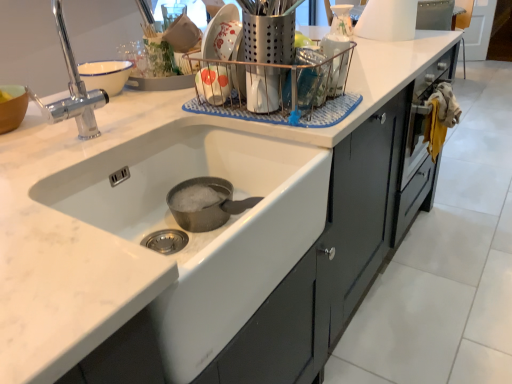
The width and height of the screenshot is (512, 384). What do you see at coordinates (336, 62) in the screenshot? I see `clear plastic container at upper center, the second appliance in the left-to-right sequence` at bounding box center [336, 62].

At what (x,y) coordinates should I click in order to perform the action: click on satin silver utensil holder at upper center, which appears as the 4th appliance when viewed from the right. Please return your answer as a coordinate pair (x, y). This screenshot has height=384, width=512. Looking at the image, I should click on (268, 31).

How much space does white glossy coffee pot at upper center, the first appliance when ordered from back to front, occupy horizontally?

white glossy coffee pot at upper center, the first appliance when ordered from back to front, is 10.92 centimeters in width.

In order to click on white glossy sink at center in this screenshot , I will do `click(205, 232)`.

Based on their positions, is clear plastic container at upper center, the third appliance viewed from the right, located to the left or right of white glossy sink at center?

From the image, it's evident that clear plastic container at upper center, the third appliance viewed from the right, is to the right of white glossy sink at center.

Is clear plastic container at upper center, marked as the 2th appliance in a front-to-back arrangement, wider than white glossy sink at center?

In fact, clear plastic container at upper center, marked as the 2th appliance in a front-to-back arrangement, might be narrower than white glossy sink at center.

Is clear plastic container at upper center, the third appliance viewed from the right, facing away from white glossy sink at center?

No, white glossy sink at center is not at the back of clear plastic container at upper center, the third appliance viewed from the right.

Is clear plastic container at upper center, marked as the 2th appliance in a front-to-back arrangement, bigger or smaller than white glossy sink at center?

Clearly, clear plastic container at upper center, marked as the 2th appliance in a front-to-back arrangement, is smaller in size than white glossy sink at center.

How different are the orientations of white glossy paper towel dispenser at upper right, arranged as the second appliance when viewed from the back, and satin silver utensil holder at upper center, the first appliance positioned from the front, in degrees?

93.9 degrees.

Image resolution: width=512 pixels, height=384 pixels. Identify the location of appliance above the white glossy paper towel dispenser at upper right, arranged as the second appliance when viewed from the back (from a real-world perspective). (268, 31).

Which object is closer to the camera, white glossy paper towel dispenser at upper right, which is the fourth appliance from left to right, or satin silver utensil holder at upper center, which appears as the 4th appliance when viewed from the right?

satin silver utensil holder at upper center, which appears as the 4th appliance when viewed from the right, is in front.

Considering the relative sizes of white glossy paper towel dispenser at upper right, placed as the 1th appliance when sorted from right to left, and satin silver utensil holder at upper center, the first appliance positioned from the front, in the image provided, is white glossy paper towel dispenser at upper right, placed as the 1th appliance when sorted from right to left, wider than satin silver utensil holder at upper center, the first appliance positioned from the front,?

Indeed, white glossy paper towel dispenser at upper right, placed as the 1th appliance when sorted from right to left, has a greater width compared to satin silver utensil holder at upper center, the first appliance positioned from the front.

From the image's perspective, does clear plastic container at upper center, the second appliance in the left-to-right sequence, appear higher than white glossy paper towel dispenser at upper right, which is the fourth appliance from left to right?

No.

Is clear plastic container at upper center, the third appliance in the back-to-front sequence, in front of or behind white glossy paper towel dispenser at upper right, arranged as the second appliance when viewed from the back, in the image?

clear plastic container at upper center, the third appliance in the back-to-front sequence, is positioned closer to the viewer than white glossy paper towel dispenser at upper right, arranged as the second appliance when viewed from the back.

Could you tell me if clear plastic container at upper center, the second appliance in the left-to-right sequence, is turned towards white glossy paper towel dispenser at upper right, arranged as the second appliance when viewed from the back?

No, clear plastic container at upper center, the second appliance in the left-to-right sequence, is not turned towards white glossy paper towel dispenser at upper right, arranged as the second appliance when viewed from the back.

Does white glossy sink at center have a greater height compared to satin silver utensil holder at upper center, which appears as the fourth appliance when viewed from the back?

Correct, white glossy sink at center is much taller as satin silver utensil holder at upper center, which appears as the fourth appliance when viewed from the back.

From a real-world perspective, does white glossy sink at center stand above satin silver utensil holder at upper center, the first appliance positioned from the front?

Incorrect, from a real-world perspective, white glossy sink at center is lower than satin silver utensil holder at upper center, the first appliance positioned from the front.

Can we say white glossy sink at center lies outside satin silver utensil holder at upper center, which appears as the 4th appliance when viewed from the right?

Indeed, white glossy sink at center is completely outside satin silver utensil holder at upper center, which appears as the 4th appliance when viewed from the right.

From the image's perspective, is white glossy coffee pot at upper center, which is the fourth appliance in front-to-back order, located above satin silver utensil holder at upper center, which appears as the 4th appliance when viewed from the right?

Yes, from the image's perspective, white glossy coffee pot at upper center, which is the fourth appliance in front-to-back order, is above satin silver utensil holder at upper center, which appears as the 4th appliance when viewed from the right.

Is white glossy coffee pot at upper center, the second appliance in the right-to-left sequence, shorter than satin silver utensil holder at upper center, which appears as the fourth appliance when viewed from the back?

Indeed, white glossy coffee pot at upper center, the second appliance in the right-to-left sequence, has a lesser height compared to satin silver utensil holder at upper center, which appears as the fourth appliance when viewed from the back.

Is white glossy coffee pot at upper center, the first appliance when ordered from back to front, positioned with its back to satin silver utensil holder at upper center, which appears as the fourth appliance when viewed from the back?

No.

Can you confirm if white glossy coffee pot at upper center, the first appliance when ordered from back to front, is wider than satin silver utensil holder at upper center, which appears as the fourth appliance when viewed from the back?

In fact, white glossy coffee pot at upper center, the first appliance when ordered from back to front, might be narrower than satin silver utensil holder at upper center, which appears as the fourth appliance when viewed from the back.

Considering the positions of point (404, 12) and point (334, 96), is point (404, 12) closer or farther from the camera than point (334, 96)?

Point (404, 12) is farther from the camera than point (334, 96).

From a real-world perspective, is white glossy paper towel dispenser at upper right, which is the fourth appliance from left to right, positioned above or below clear plastic container at upper center, marked as the 2th appliance in a front-to-back arrangement?

Clearly, from a real-world perspective, white glossy paper towel dispenser at upper right, which is the fourth appliance from left to right, is above clear plastic container at upper center, marked as the 2th appliance in a front-to-back arrangement.

Where is `the 2nd appliance counting from the left of the white glossy paper towel dispenser at upper right, arranged as the second appliance when viewed from the back`? This screenshot has height=384, width=512. the 2nd appliance counting from the left of the white glossy paper towel dispenser at upper right, arranged as the second appliance when viewed from the back is located at coordinates tap(336, 62).

Between white glossy paper towel dispenser at upper right, which ranks as the 3th appliance in front-to-back order, and clear plastic container at upper center, the second appliance in the left-to-right sequence, which one has larger size?

white glossy paper towel dispenser at upper right, which ranks as the 3th appliance in front-to-back order, is bigger.

Is white glossy paper towel dispenser at upper right, which is the fourth appliance from left to right, at the back of satin silver utensil holder at upper center, the first appliance positioned from the front?

No.

Between satin silver utensil holder at upper center, which appears as the fourth appliance when viewed from the back, and white glossy paper towel dispenser at upper right, which ranks as the 3th appliance in front-to-back order, which one is positioned behind?

white glossy paper towel dispenser at upper right, which ranks as the 3th appliance in front-to-back order, is more distant.

Considering the relative sizes of satin silver utensil holder at upper center, the first appliance positioned from the front, and white glossy paper towel dispenser at upper right, which is the fourth appliance from left to right, in the image provided, is satin silver utensil holder at upper center, the first appliance positioned from the front, smaller than white glossy paper towel dispenser at upper right, which is the fourth appliance from left to right,?

Yes.

From a real-world perspective, count 2nd appliances upward from the white glossy sink at center and point to it. Please provide its 2D coordinates.

[(336, 62)]

Locate an element on the screen. The width and height of the screenshot is (512, 384). the 3rd appliance to the right of the satin silver utensil holder at upper center, the first appliance positioned from the front, counting from the anchor's position is located at coordinates (388, 20).

From the image, which object appears to be nearer to white glossy coffee pot at upper center, acting as the third appliance starting from the left, clear plastic container at upper center, the third appliance viewed from the right, or white glossy sink at center?

Based on the image, clear plastic container at upper center, the third appliance viewed from the right, appears to be nearer to white glossy coffee pot at upper center, acting as the third appliance starting from the left.

Which object lies further to the anchor point white glossy paper towel dispenser at upper right, placed as the 1th appliance when sorted from right to left, white glossy sink at center or clear plastic container at upper center, the second appliance in the left-to-right sequence?

Among the two, white glossy sink at center is located further to white glossy paper towel dispenser at upper right, placed as the 1th appliance when sorted from right to left.

Which object lies further to the anchor point satin silver utensil holder at upper center, which appears as the 4th appliance when viewed from the right, clear plastic container at upper center, marked as the 2th appliance in a front-to-back arrangement, or white glossy sink at center?

white glossy sink at center is further to satin silver utensil holder at upper center, which appears as the 4th appliance when viewed from the right.

Estimate the real-world distances between objects in this image. Which object is further from white glossy coffee pot at upper center, acting as the third appliance starting from the left, clear plastic container at upper center, the third appliance viewed from the right, or satin silver utensil holder at upper center, acting as the first appliance starting from the left?

satin silver utensil holder at upper center, acting as the first appliance starting from the left.

From the image, which object appears to be farther from white glossy coffee pot at upper center, the second appliance in the right-to-left sequence, satin silver utensil holder at upper center, acting as the first appliance starting from the left, or white glossy sink at center?

white glossy sink at center is further to white glossy coffee pot at upper center, the second appliance in the right-to-left sequence.

Estimate the real-world distances between objects in this image. Which object is further from clear plastic container at upper center, the third appliance in the back-to-front sequence, white glossy sink at center or satin silver utensil holder at upper center, acting as the first appliance starting from the left?

Among the two, white glossy sink at center is located further to clear plastic container at upper center, the third appliance in the back-to-front sequence.

Based on their spatial positions, is white glossy coffee pot at upper center, acting as the third appliance starting from the left, or white glossy paper towel dispenser at upper right, arranged as the second appliance when viewed from the back, closer to white glossy sink at center?

white glossy paper towel dispenser at upper right, arranged as the second appliance when viewed from the back, lies closer to white glossy sink at center than the other object.

Based on their spatial positions, is white glossy coffee pot at upper center, the first appliance when ordered from back to front, or satin silver utensil holder at upper center, acting as the first appliance starting from the left, closer to white glossy sink at center?

Based on the image, satin silver utensil holder at upper center, acting as the first appliance starting from the left, appears to be nearer to white glossy sink at center.

Where is `appliance that lies between satin silver utensil holder at upper center, acting as the first appliance starting from the left, and white glossy sink at center from top to bottom`? Image resolution: width=512 pixels, height=384 pixels. appliance that lies between satin silver utensil holder at upper center, acting as the first appliance starting from the left, and white glossy sink at center from top to bottom is located at coordinates (336, 62).

The width and height of the screenshot is (512, 384). I want to click on appliance between clear plastic container at upper center, marked as the 2th appliance in a front-to-back arrangement, and white glossy coffee pot at upper center, which is the fourth appliance in front-to-back order, in the front-back direction, so tap(388, 20).

Find the location of `appliance between satin silver utensil holder at upper center, which appears as the 4th appliance when viewed from the right, and white glossy paper towel dispenser at upper right, placed as the 1th appliance when sorted from right to left, from front to back`. appliance between satin silver utensil holder at upper center, which appears as the 4th appliance when viewed from the right, and white glossy paper towel dispenser at upper right, placed as the 1th appliance when sorted from right to left, from front to back is located at coordinates (336, 62).